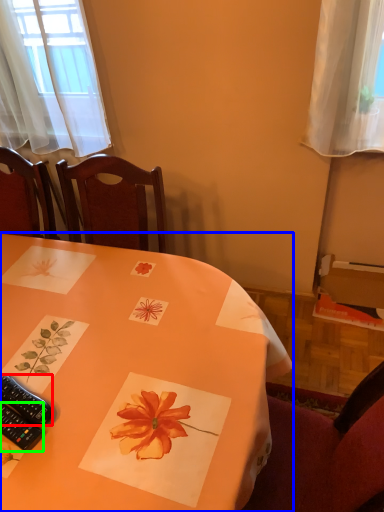
Question: Which is nearer to the remote control (highlighted by a red box)? table (highlighted by a blue box) or remote control (highlighted by a green box).

Choices:
 (A) table
 (B) remote control

Answer: (B)